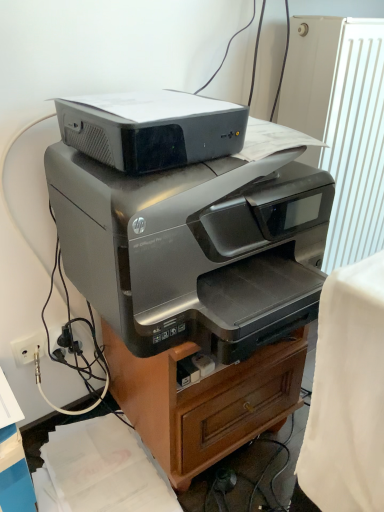
Question: Considering the relative sizes of satin silver printer at center and matte black printer at upper center, arranged as the 1th printer when viewed from the top, in the image provided, is satin silver printer at center shorter than matte black printer at upper center, arranged as the 1th printer when viewed from the top,?

Choices:
 (A) yes
 (B) no

Answer: (B)

Question: Is satin silver printer at center positioned before matte black printer at upper center, which appears as the second printer when ordered from the bottom?

Choices:
 (A) no
 (B) yes

Answer: (A)

Question: Is matte black printer at upper center, which appears as the second printer when ordered from the bottom, surrounded by satin silver printer at center?

Choices:
 (A) no
 (B) yes

Answer: (A)

Question: Would you say satin silver printer at center is outside matte black printer at upper center, which appears as the second printer when ordered from the bottom?

Choices:
 (A) yes
 (B) no

Answer: (A)

Question: Is satin silver printer at center at the left side of matte black printer at upper center, which appears as the second printer when ordered from the bottom?

Choices:
 (A) no
 (B) yes

Answer: (A)

Question: Is satin silver printer at center turned away from matte black printer at upper center, which appears as the second printer when ordered from the bottom?

Choices:
 (A) yes
 (B) no

Answer: (B)

Question: Does white textured radiator at upper right come behind black plastic plug at lower left?

Choices:
 (A) yes
 (B) no

Answer: (B)

Question: Does white textured radiator at upper right appear on the right side of black plastic plug at lower left?

Choices:
 (A) no
 (B) yes

Answer: (B)

Question: Is white textured radiator at upper right taller than black plastic plug at lower left?

Choices:
 (A) no
 (B) yes

Answer: (B)

Question: Can you confirm if white textured radiator at upper right is bigger than black plastic plug at lower left?

Choices:
 (A) yes
 (B) no

Answer: (A)

Question: Are white textured radiator at upper right and black plastic plug at lower left located far from each other?

Choices:
 (A) yes
 (B) no

Answer: (B)

Question: Considering the relative sizes of white textured radiator at upper right and black plastic plug at lower left in the image provided, is white textured radiator at upper right smaller than black plastic plug at lower left?

Choices:
 (A) no
 (B) yes

Answer: (A)

Question: Can you confirm if white textured radiator at upper right is shorter than satin silver printer at center, which ranks as the 1th printer in bottom-to-top order?

Choices:
 (A) yes
 (B) no

Answer: (B)